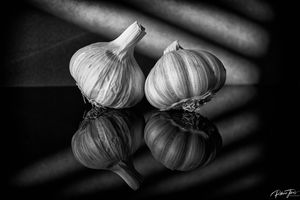
The image size is (300, 200). I want to click on wall, so click(x=38, y=26), click(x=245, y=21).